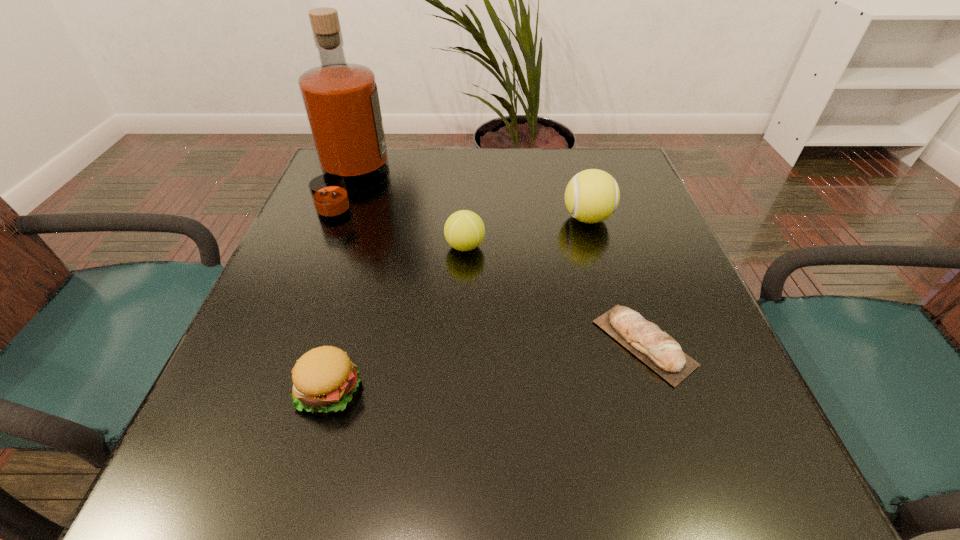
You are a GUI agent. You are given a task and a screenshot of the screen. Output one action in this format:
    pyautogui.click(x=<x>, y=<y>)
    Task: Click on the free spot located on the right of the hamburger
    The width and height of the screenshot is (960, 540).
    Given the screenshot: What is the action you would take?
    pyautogui.click(x=545, y=390)

Locate an element on the screen. free location located 0.200m on the left of the pita bread is located at coordinates (478, 343).

The height and width of the screenshot is (540, 960). I want to click on object situated at the far edge, so 341,101.

Locate an element on the screen. Image resolution: width=960 pixels, height=540 pixels. liquor positioned at the left edge is located at coordinates (341, 101).

You are a GUI agent. You are given a task and a screenshot of the screen. Output one action in this format:
    pyautogui.click(x=<x>, y=<y>)
    Task: Click on the hamburger at the left edge
    The image size is (960, 540).
    Given the screenshot: What is the action you would take?
    pyautogui.click(x=324, y=378)

Locate an element on the screen. This screenshot has width=960, height=540. tennis ball that is at the right edge is located at coordinates (591, 196).

Where is `pita bread at the right edge`? pita bread at the right edge is located at coordinates pyautogui.click(x=663, y=354).

Where is `object at the far left corner`? This screenshot has width=960, height=540. object at the far left corner is located at coordinates (341, 101).

The width and height of the screenshot is (960, 540). I want to click on vacant space at the far edge, so click(x=447, y=168).

In the image, there is a desktop. At what (x,y) coordinates should I click in order to perform the action: click on free space at the near edge. Please return your answer as a coordinate pair (x, y). This screenshot has height=540, width=960. Looking at the image, I should click on [x=355, y=492].